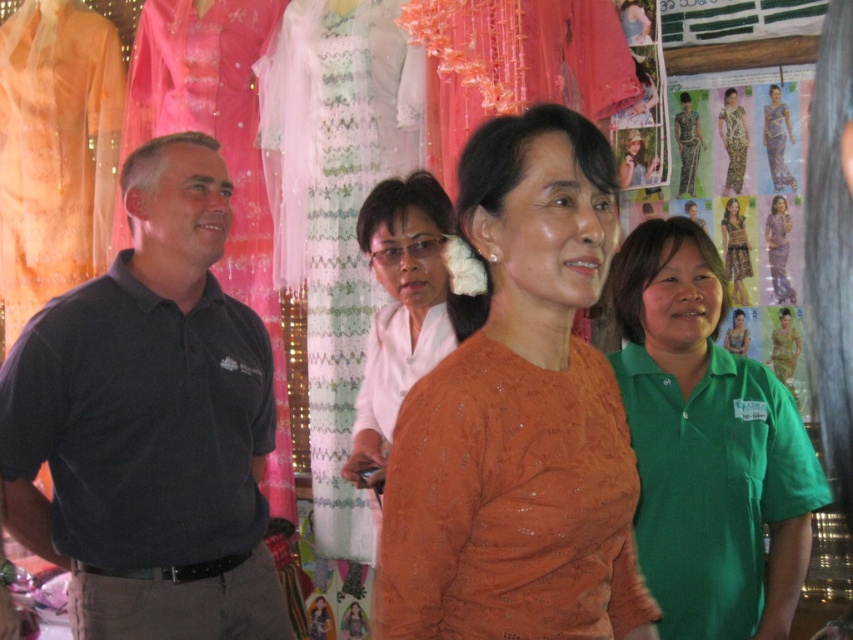
Between point (584, 282) and point (718, 289), which one is positioned behind?

The point (718, 289) is more distant.

Is orange textured sweater at center to the right of green fabric shirt at center from the viewer's perspective?

In fact, orange textured sweater at center is to the left of green fabric shirt at center.

Between point (633, 589) and point (625, 333), which one is positioned in front?

Point (633, 589) is more forward.

In order to click on orange textured sweater at center in this screenshot , I will do `click(518, 417)`.

Does orange textured sweater at center appear over matte white shirt at center?

No, orange textured sweater at center is not above matte white shirt at center.

This screenshot has height=640, width=853. What do you see at coordinates (518, 417) in the screenshot?
I see `orange textured sweater at center` at bounding box center [518, 417].

In order to click on orange textured sweater at center in this screenshot , I will do `click(518, 417)`.

Which is below, dark blue polo shirt at left or green fabric shirt at center?

green fabric shirt at center

Which is more to the right, dark blue polo shirt at left or green fabric shirt at center?

green fabric shirt at center

The height and width of the screenshot is (640, 853). What do you see at coordinates (149, 422) in the screenshot?
I see `dark blue polo shirt at left` at bounding box center [149, 422].

Where is `dark blue polo shirt at left`? The height and width of the screenshot is (640, 853). dark blue polo shirt at left is located at coordinates (149, 422).